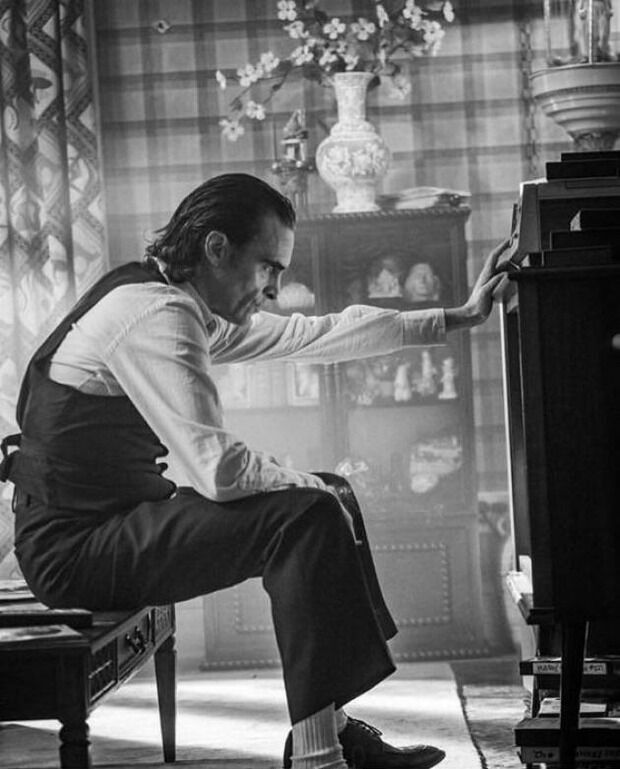
Identify the location of sock. (317, 731), (342, 717).